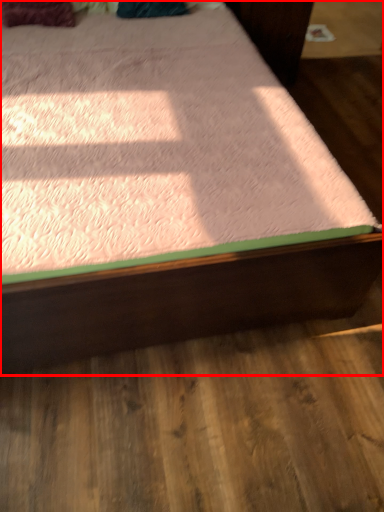
Question: From the image's perspective, considering the relative positions of bed (annotated by the red box) and pillow in the image provided, where is bed (annotated by the red box) located with respect to the staircase?

Choices:
 (A) below
 (B) above

Answer: (A)